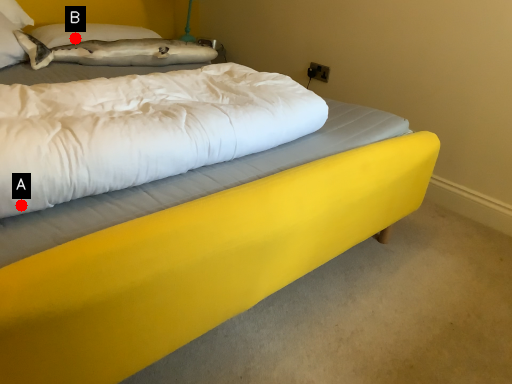
Question: Two points are circled on the image, labeled by A and B beside each circle. Which point is closer to the camera?

Choices:
 (A) A is closer
 (B) B is closer

Answer: (A)